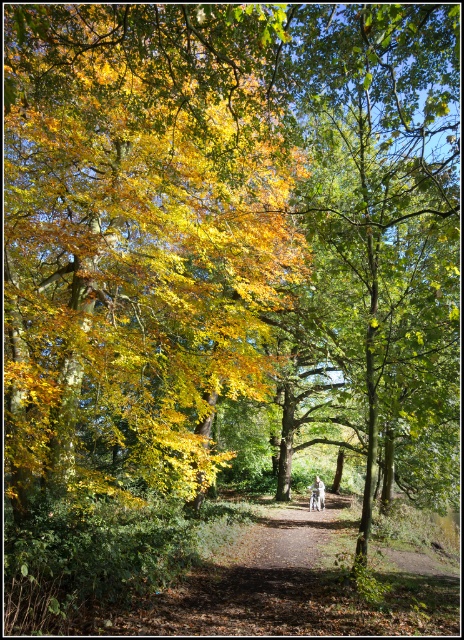
Can you confirm if golden yellow leaves at center is shorter than white cotton shirt at center?

In fact, golden yellow leaves at center may be taller than white cotton shirt at center.

Between point (225, 17) and point (319, 500), which one is positioned in front?

Point (225, 17) is in front.

The image size is (464, 640). I want to click on golden yellow leaves at center, so click(139, 234).